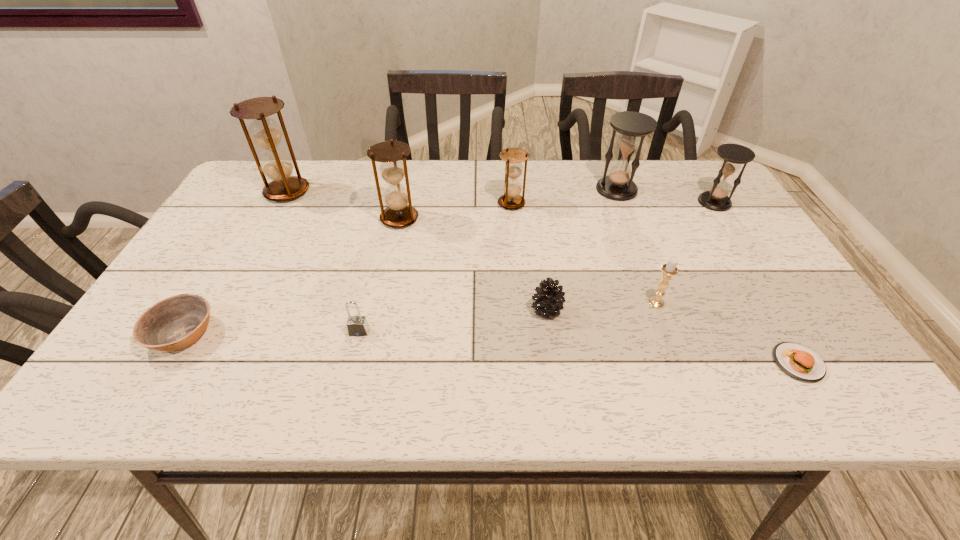
Find the location of a particular element. This screenshot has height=540, width=960. the tallest object is located at coordinates (276, 165).

Find the location of a particular element. The width and height of the screenshot is (960, 540). the biggest brown hourglass is located at coordinates (276, 165).

Where is `the bigger black hourglass`? the bigger black hourglass is located at coordinates (632, 127).

This screenshot has width=960, height=540. In order to click on the left black hourglass in this screenshot , I will do `click(632, 127)`.

The image size is (960, 540). In order to click on the fourth hourglass from right to left in this screenshot , I will do `click(392, 170)`.

Where is `the second biggest brown hourglass`? the second biggest brown hourglass is located at coordinates (392, 170).

Image resolution: width=960 pixels, height=540 pixels. Identify the location of the right black hourglass. (716, 199).

Where is `the smaller black hourglass`? The width and height of the screenshot is (960, 540). the smaller black hourglass is located at coordinates coord(716,199).

In order to click on the smallest brown hourglass in this screenshot , I will do `click(511, 199)`.

Find the location of `the rightmost brown hourglass`. the rightmost brown hourglass is located at coordinates (511, 199).